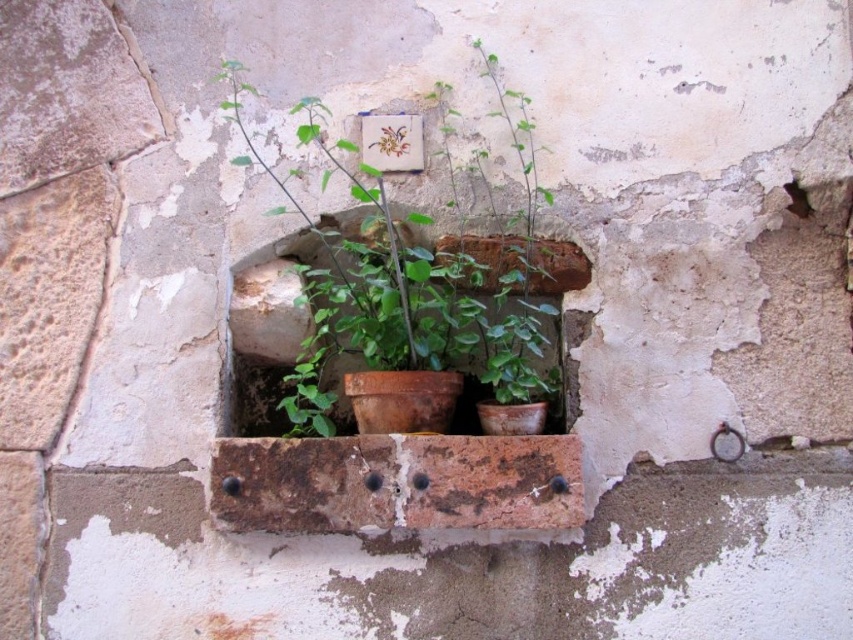
Consider the image. You are standing 1.5 meters away from the wall. You want to reach a point marked at coordinates point (309, 388). Can you reach it without moving closer to the wall?

The distance of point (309, 388) from camera is 1.48 meters. Since you are currently 1.5 meters away from the wall, you can reach the point without moving closer as you are slightly farther than the point.